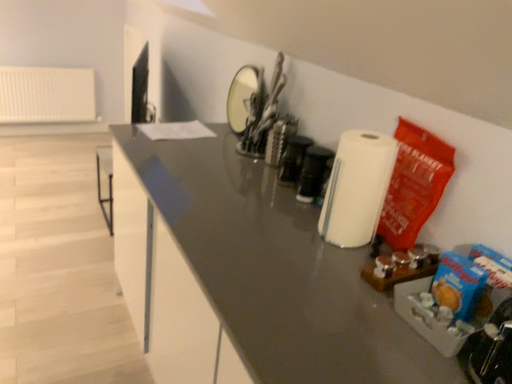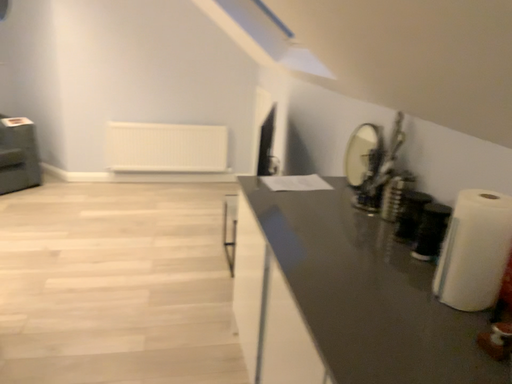
Question: How did the camera likely rotate when shooting the video?

Choices:
 (A) rotated right
 (B) rotated left

Answer: (B)